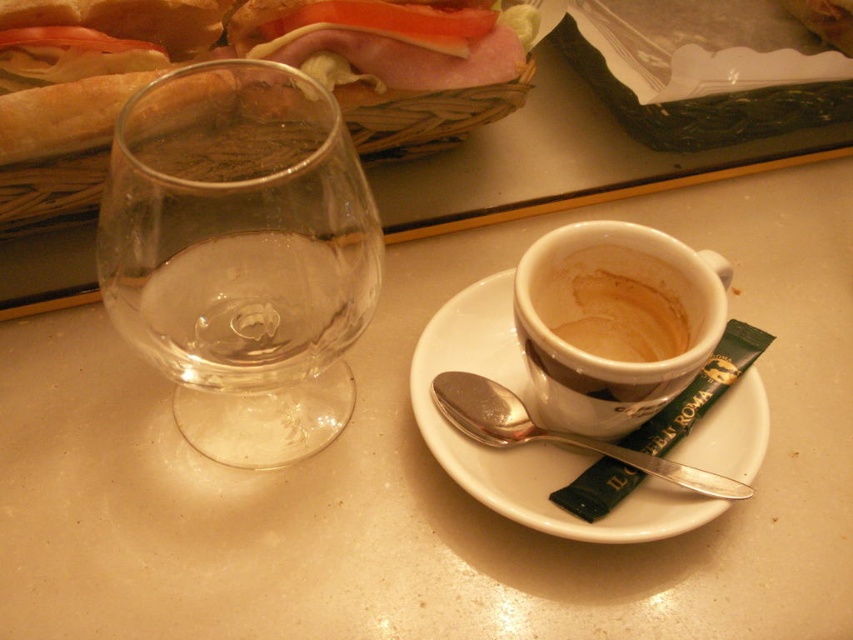
Can you confirm if transparent glass wine glass at left is wider than brown matte cup at center right?

Yes.

Does transparent glass wine glass at left appear under brown matte cup at center right?

No, transparent glass wine glass at left is not below brown matte cup at center right.

Between point (212, 266) and point (637, 352), which one is positioned behind?

Point (637, 352)

Find the location of a particular element. transparent glass wine glass at left is located at coordinates tap(241, 256).

Is white ceramic saucer at center smaller than brown matte cup at center right?

Actually, white ceramic saucer at center might be larger than brown matte cup at center right.

Does white ceramic saucer at center appear on the left side of brown matte cup at center right?

Yes, white ceramic saucer at center is to the left of brown matte cup at center right.

Which is in front, point (604, 520) or point (563, 294)?

Point (604, 520)

This screenshot has width=853, height=640. I want to click on white ceramic saucer at center, so click(x=526, y=444).

Locate an element on the screen. The width and height of the screenshot is (853, 640). transparent glass wine glass at left is located at coordinates (241, 256).

Who is more forward, (260, 419) or (521, 49)?

Point (260, 419) is in front.

You are a GUI agent. You are given a task and a screenshot of the screen. Output one action in this format:
    pyautogui.click(x=<x>, y=<y>)
    Task: Click on the transparent glass wine glass at left
    
    Given the screenshot: What is the action you would take?
    pyautogui.click(x=241, y=256)